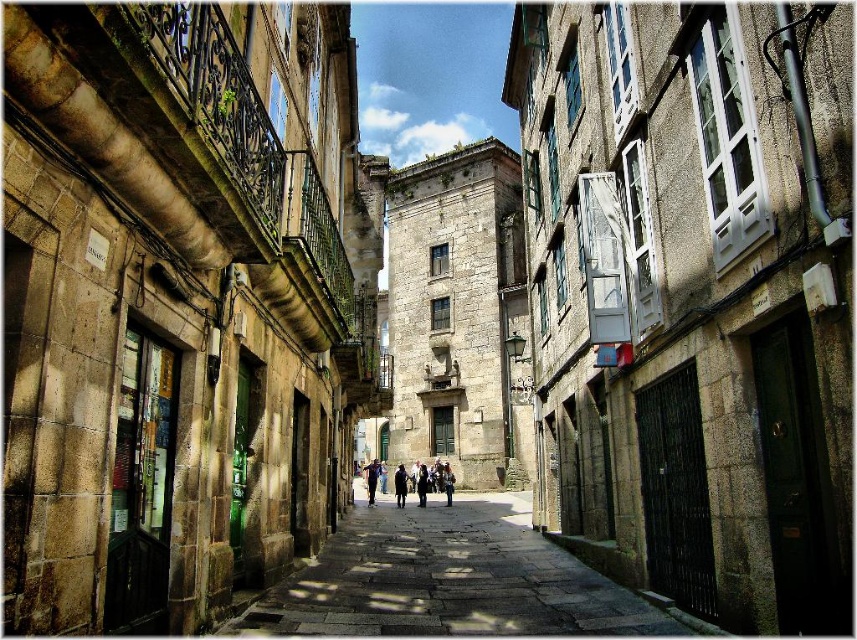
Does blue denim jeans at center come in front of dark blue coat at center?

No, blue denim jeans at center is further to the viewer.

Between blue denim jeans at center and dark blue coat at center, which one appears on the right side from the viewer's perspective?

From the viewer's perspective, dark blue coat at center appears more on the right side.

At what (x,y) coordinates should I click in order to perform the action: click on blue denim jeans at center. Please return your answer as a coordinate pair (x, y). The image size is (857, 640). Looking at the image, I should click on (370, 480).

Between dark blue jeans at center and dark blue coat at center, which one has less height?

With less height is dark blue coat at center.

Can you confirm if dark blue jeans at center is taller than dark blue coat at center?

Yes.

Who is more distant from viewer, (418, 476) or (396, 481)?

The point (418, 476) is behind.

Identify the location of dark blue jeans at center. This screenshot has height=640, width=857. (444, 477).

Which is below, dark blue jeans at center or blue denim jeans at center?

blue denim jeans at center is lower down.

How far apart are dark blue jeans at center and blue denim jeans at center?

8.00 meters

Does point (448, 500) lie in front of point (373, 472)?

That is True.

Where is `dark blue jeans at center`? The height and width of the screenshot is (640, 857). dark blue jeans at center is located at coordinates (444, 477).